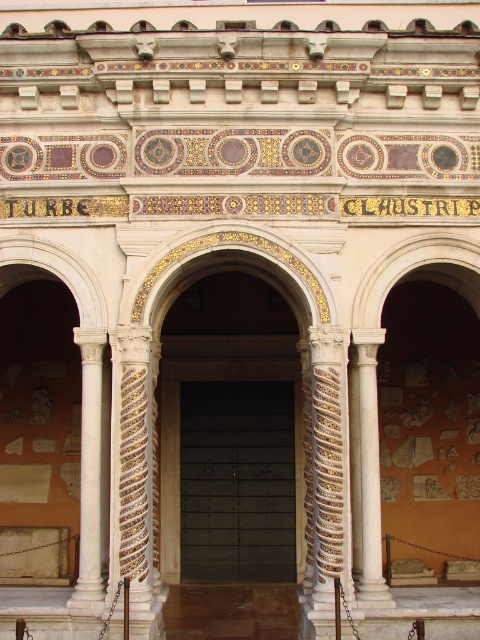
You are standing at the entrance of the historical building and want to locate two specific points marked on the arches. The first point is at coordinates point (368,524) and the second is at point (364,547). Which point is closer to you when you are facing the entrance?

Point (364,547) is closer to you because it is in front of point (368,524).

You are standing at the entrance of the historical building and want to take a photo of the white marble archway at center. If you are at the point of origin, where should you aim your camera to capture the archway?

You should aim your camera at the coordinates point of origin to point (416,412) to capture the white marble archway at center.

You are an architect designing a new building and want to replicate the entrance of the historical building shown. You need to ensure that the white marble archway at center aligns properly with the black metal door at center. Based on the image, which object should be wider to maintain the historical design proportions?

The white marble archway at center should be wider than the black metal door at center to maintain the historical design proportions.